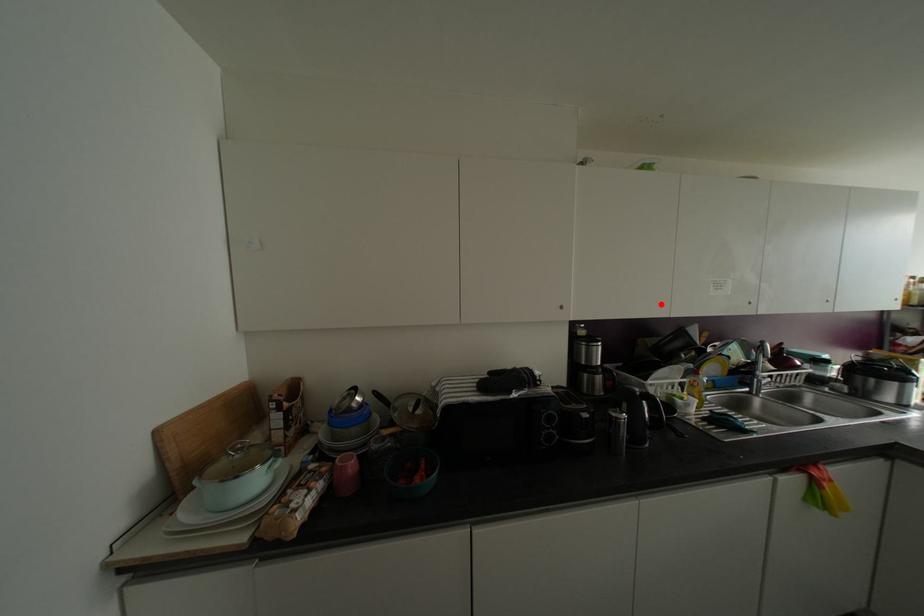
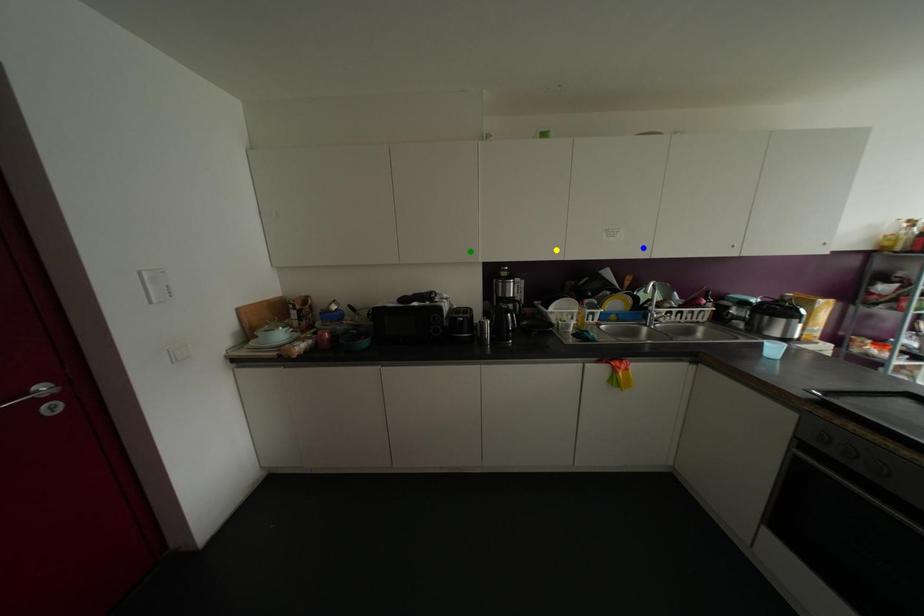
Question: I am providing you with two images of the same scene from different viewpoints. A red point is marked on the first image. You are given multiple points on the second image. In image 2, which mark is for the same physical point as the one in image 1?

Choices:
 (A) green point
 (B) blue point
 (C) yellow point

Answer: (C)